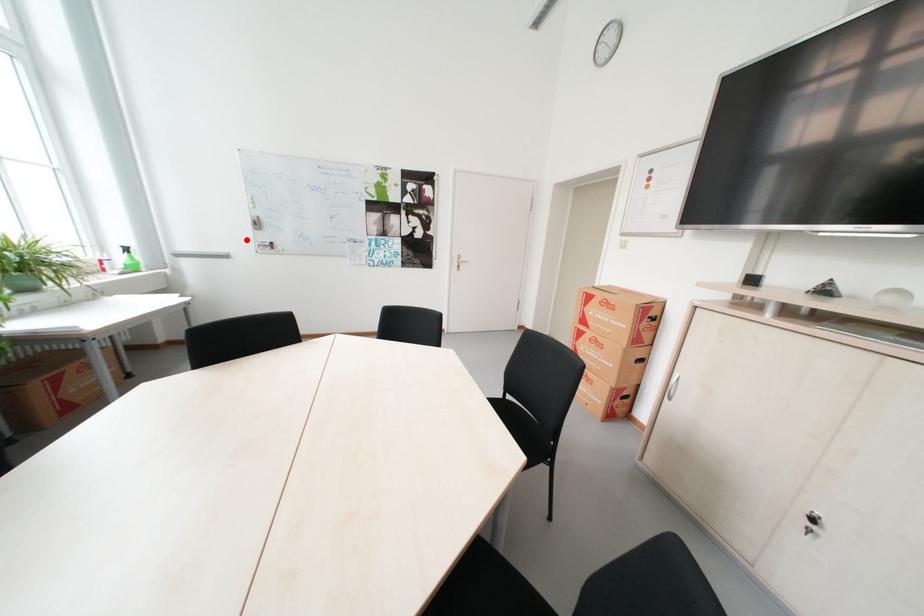
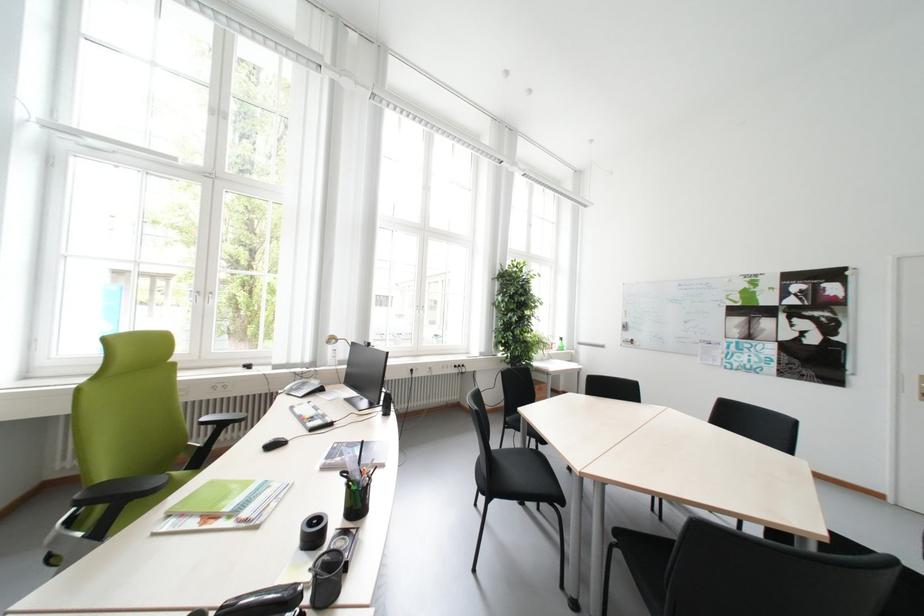
Where in the second image is the point corresponding to the highlighted location from the first image?

(621, 338)